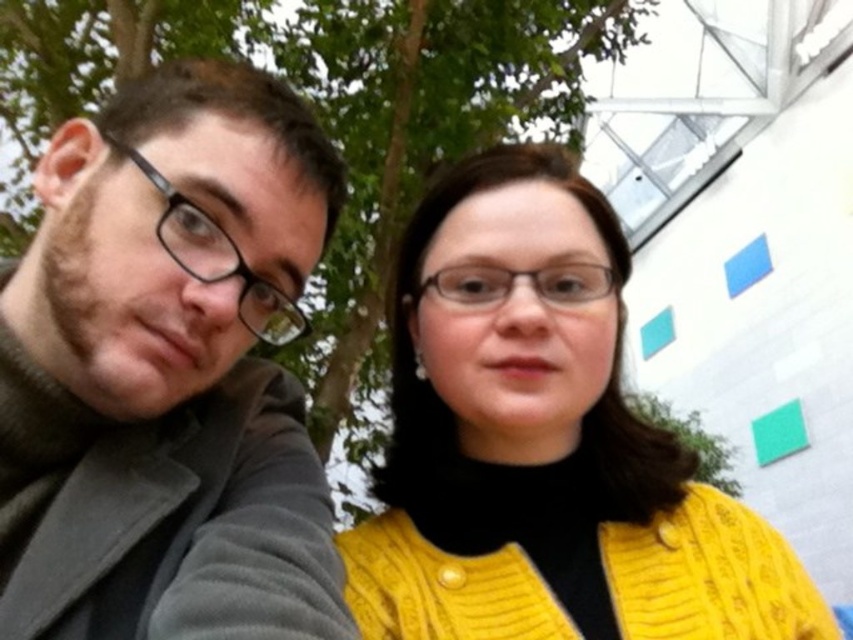
Question: Does black plastic glasses at left have a greater width compared to transparent plastic glasses at center?

Choices:
 (A) yes
 (B) no

Answer: (B)

Question: Can you confirm if black plastic glasses at left is bigger than transparent plastic glasses at center?

Choices:
 (A) no
 (B) yes

Answer: (B)

Question: Which object is farther from the camera taking this photo?

Choices:
 (A) matte black jacket at left
 (B) yellow knitted sweater at center

Answer: (B)

Question: Among these objects, which one is nearest to the camera?

Choices:
 (A) black plastic glasses at left
 (B) transparent plastic glasses at center
 (C) yellow knitted sweater at center

Answer: (A)

Question: Does black plastic glasses at left have a greater width compared to transparent plastic glasses at center?

Choices:
 (A) no
 (B) yes

Answer: (A)

Question: Which object is positioned closest to the matte black jacket at left?

Choices:
 (A) yellow knitted sweater at center
 (B) transparent plastic glasses at center
 (C) black plastic glasses at left

Answer: (C)